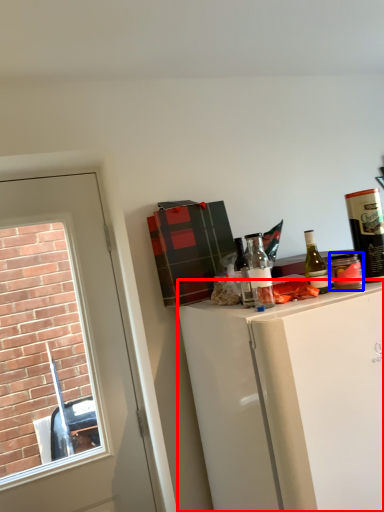
Question: Which of the following is the farthest to the observer, cabinetry (highlighted by a red box) or beverage (highlighted by a blue box)?

Choices:
 (A) cabinetry
 (B) beverage

Answer: (B)